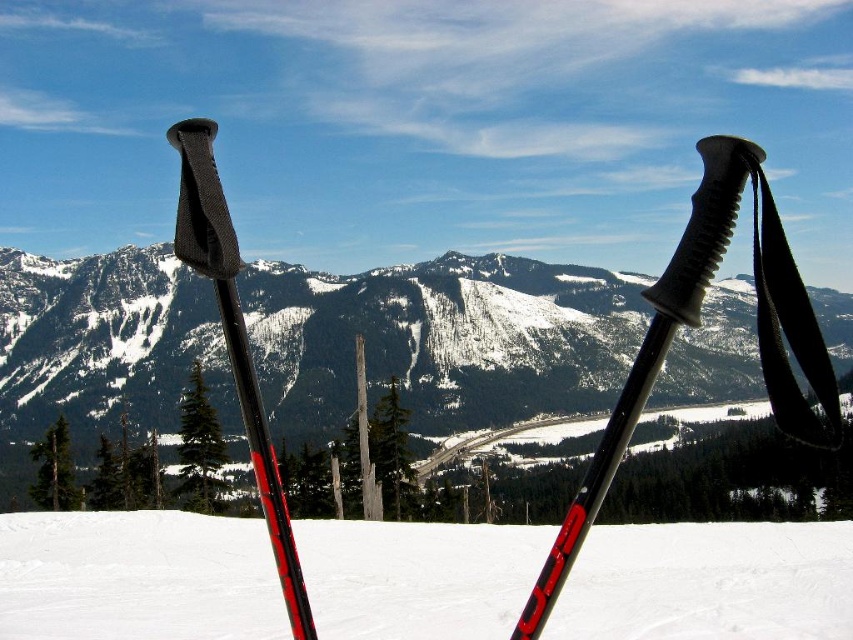
Can you confirm if matte black ski poles at center is positioned to the left of black fabric strap at right?

Yes, matte black ski poles at center is to the left of black fabric strap at right.

Is point (113, 602) farther from viewer compared to point (822, 388)?

Yes, it is.

The height and width of the screenshot is (640, 853). What do you see at coordinates (136, 577) in the screenshot?
I see `matte black ski poles at center` at bounding box center [136, 577].

Identify the location of matte black ski poles at center. (136, 577).

Between matte black ski poles at center and black rubber ski pole at center, which one has less height?

matte black ski poles at center is shorter.

Is matte black ski poles at center below black rubber ski pole at center?

Correct, matte black ski poles at center is located below black rubber ski pole at center.

Image resolution: width=853 pixels, height=640 pixels. Find the location of `matte black ski poles at center`. matte black ski poles at center is located at coordinates (136, 577).

Where is `matte black ski poles at center`? The image size is (853, 640). matte black ski poles at center is located at coordinates (136, 577).

Is snowy granite mountain at center thinner than matte black ski pole at left?

In fact, snowy granite mountain at center might be wider than matte black ski pole at left.

Is point (405, 346) positioned behind point (190, 248)?

Yes, point (405, 346) is farther from viewer.

Who is more forward, (x=13, y=396) or (x=291, y=568)?

Point (x=291, y=568) is in front.

The width and height of the screenshot is (853, 640). In order to click on snowy granite mountain at center in this screenshot , I will do `click(444, 339)`.